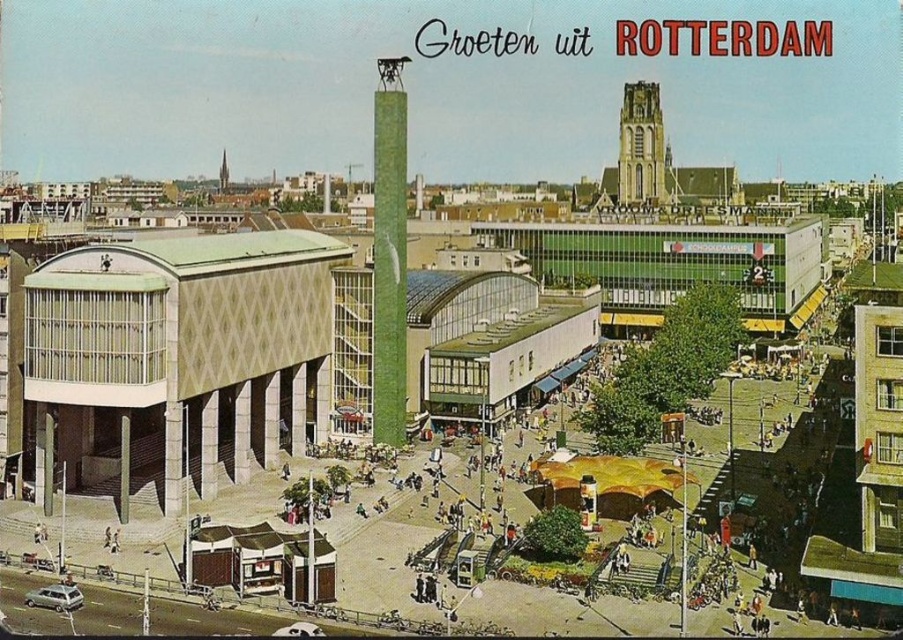
You are standing in the Rotterdam square looking at the scene. There are two points marked in the image, one at coordinates point (389,212) and another at point (621,129). Which of these two points is closer to you?

Point (389,212) is closer to the viewer than point (621,129).

You are standing at the center of the square in Rotterdam, looking around. Where is the green textured tower at center located in relation to your position?

The green textured tower at center is located at the coordinates point [389,253], which is slightly to the right and above your current position at the center of the square.

Looking at this image, you are planning to take a photo of the green textured tower at center and the green stone tower at upper right from a spot in the square. Which tower will appear bigger in the photo?

The green textured tower at center will appear bigger in the photo because it is larger in size than the green stone tower at upper right.